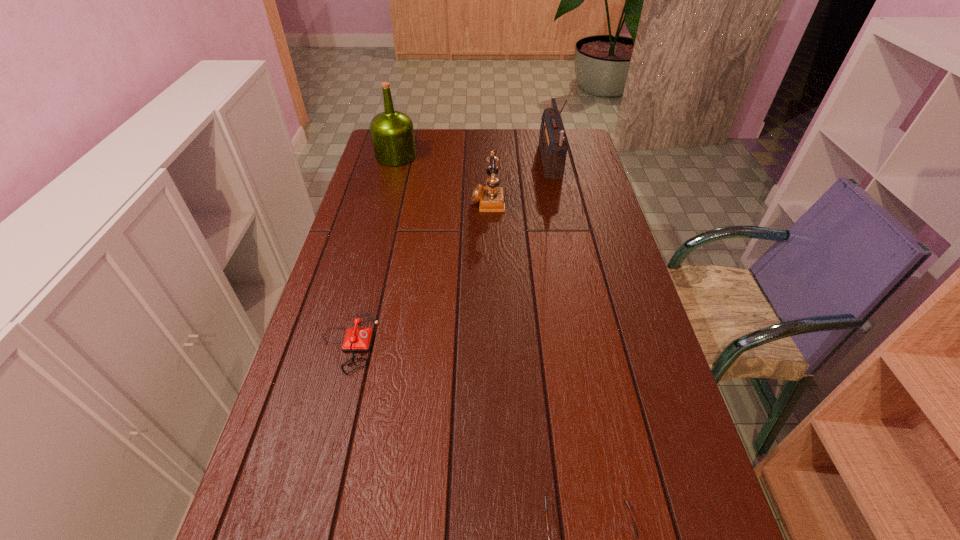
Where is `object that is the fourth closest to the fourth shortest object`? object that is the fourth closest to the fourth shortest object is located at coordinates (624, 498).

Locate an element on the screen. This screenshot has width=960, height=540. the third closest object to the farther telephone is located at coordinates point(356,339).